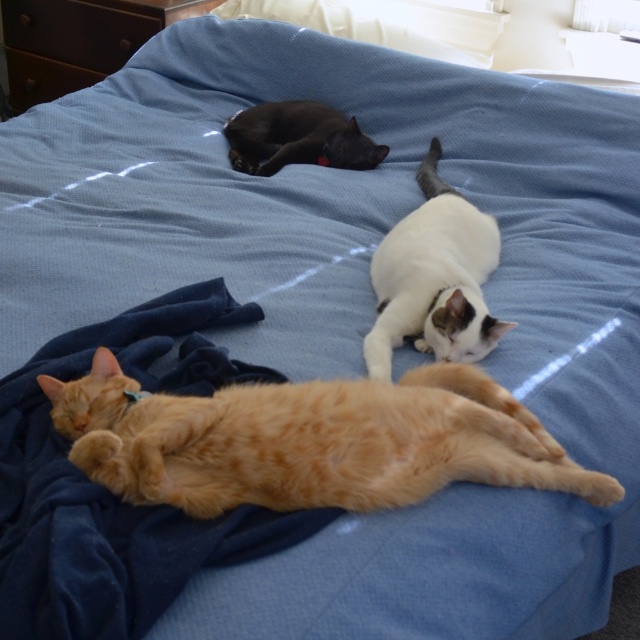
You are a cat owner who wants to place a new toy on the bed. The toy is 10 cm tall. The velvety blue blanket at lower left is 15 cm tall and the shiny black cat at center is 12 cm tall. Which object can the toy fit under?

The toy can fit under both the velvety blue blanket at lower left and the shiny black cat at center since the toy is 10 cm tall, which is shorter than both objects. However, the velvety blue blanket at lower left is closer to the viewer, making it easier to place the toy underneath.

You are a cat owner who wants to ensure all your cats have enough space to stretch out comfortably. Given the orange fur cat at lower left and the velvety blue blanket at lower left, which one takes up more area on the bed?

The orange fur cat at lower left occupies less space than the velvety blue blanket at lower left, so the blanket takes up more area on the bed.